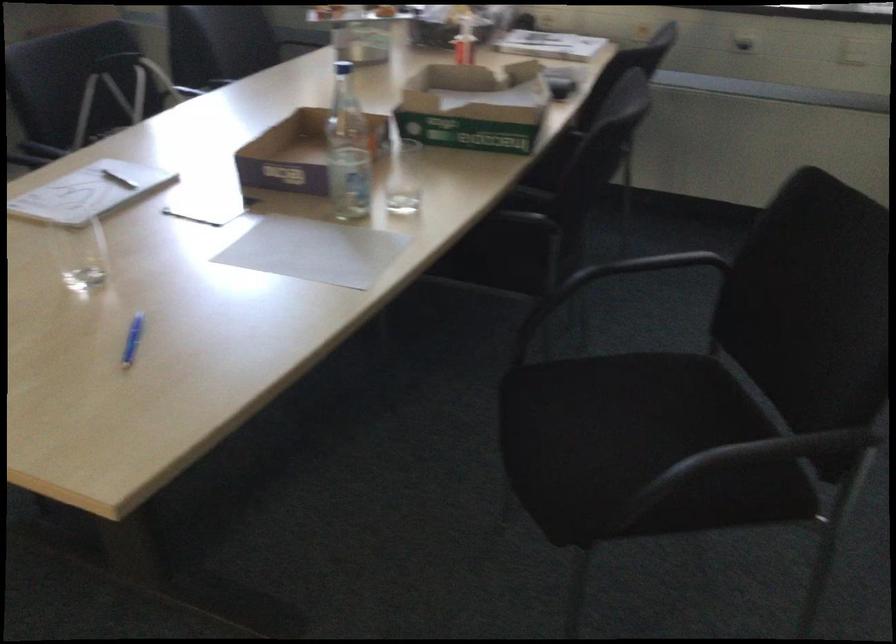
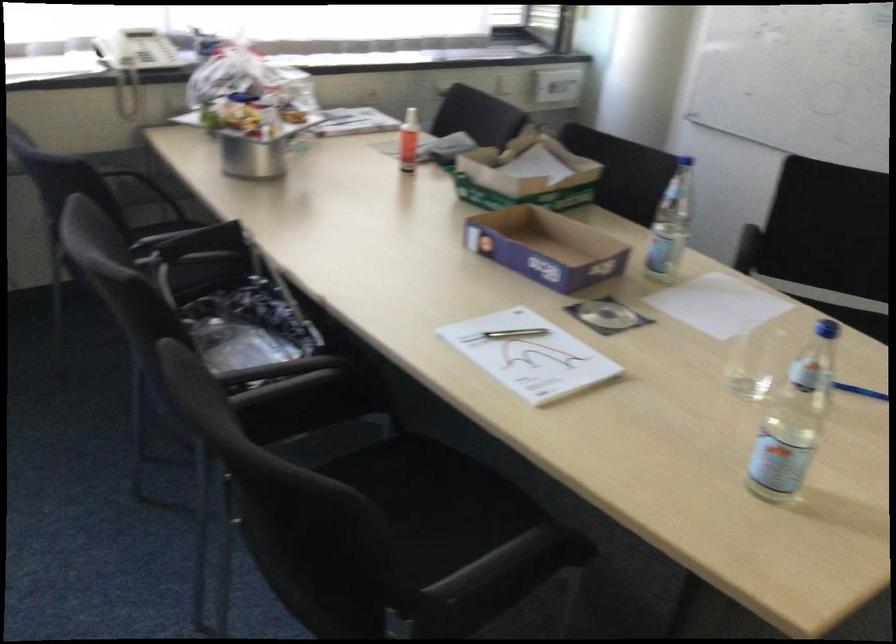
Where in the second image is the point corresponding to (339,164) from the first image?

(546, 247)